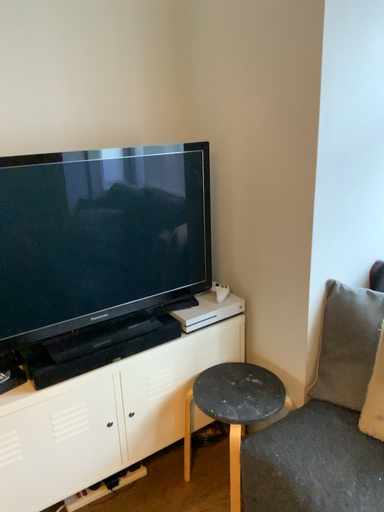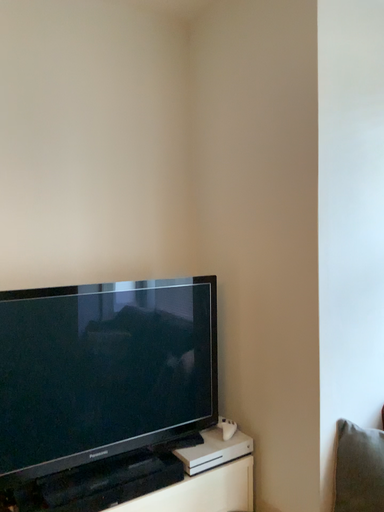
Question: Which way did the camera rotate in the video?

Choices:
 (A) rotated downward
 (B) rotated upward

Answer: (B)